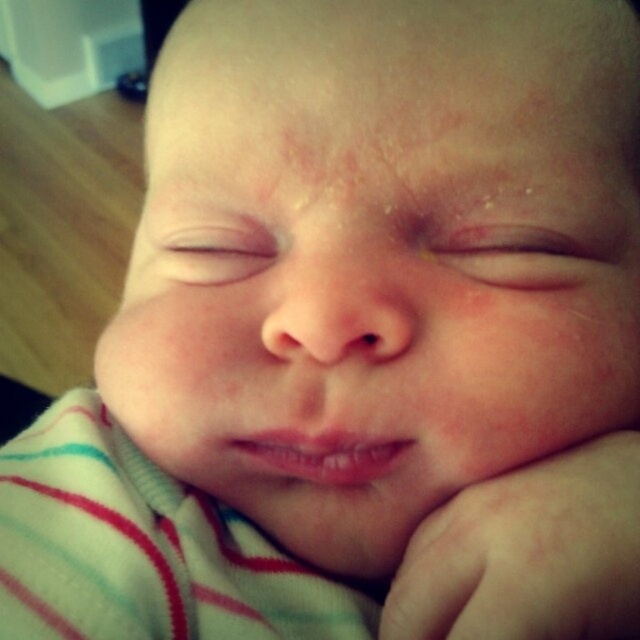
Which is below, smooth skin hand at lower right or pink smooth skin at center?

smooth skin hand at lower right is below.

Is smooth skin hand at lower right positioned behind pink smooth skin at center?

That is False.

Where is `smooth skin hand at lower right`? Image resolution: width=640 pixels, height=640 pixels. smooth skin hand at lower right is located at coordinates (529, 554).

Who is taller, pink smooth skin at center or pink smooth eye at center?

pink smooth eye at center is taller.

Which is more to the right, pink smooth skin at center or pink smooth eye at center?

pink smooth skin at center is more to the right.

The width and height of the screenshot is (640, 640). Identify the location of pink smooth skin at center. click(x=520, y=253).

Between smooth skin hand at lower right and pink smooth eye at center, which one appears on the left side from the viewer's perspective?

Positioned to the left is pink smooth eye at center.

Measure the distance between smooth skin hand at lower right and pink smooth eye at center.

smooth skin hand at lower right is 5.73 inches from pink smooth eye at center.

This screenshot has height=640, width=640. What do you see at coordinates (529, 554) in the screenshot?
I see `smooth skin hand at lower right` at bounding box center [529, 554].

What are the coordinates of `smooth skin hand at lower right` in the screenshot? It's located at (529, 554).